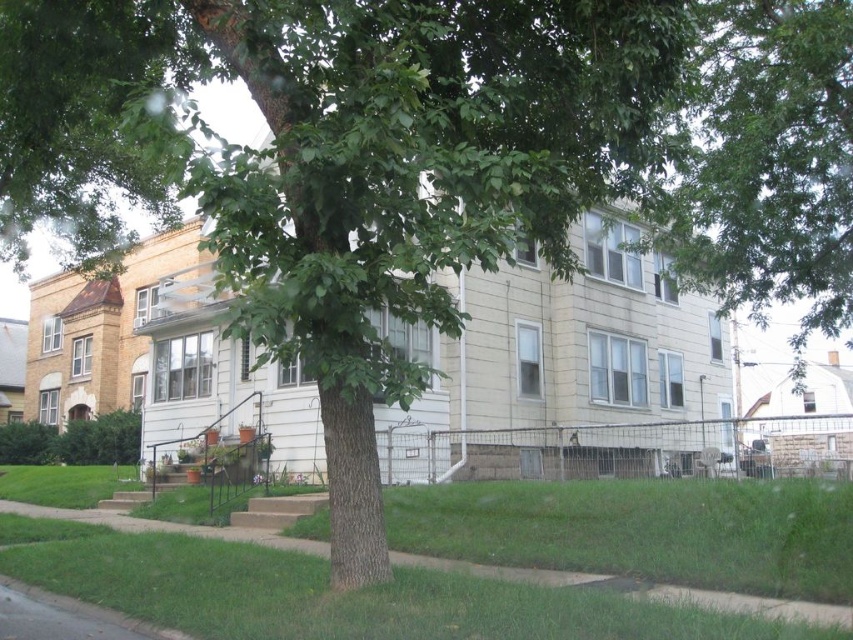
You are standing at the point marked as point (766, 163) in the image. What object is located exactly at that point?

The green leafy tree at upper center is located exactly at point (766, 163).

You are standing on the lawn looking towards the house. You see the green leafy tree at upper center and the green grass at lower center. Which object is closer to your eyes?

The green grass at lower center is closer to your eyes because it is located below the green leafy tree at upper center, which is positioned higher up.

Looking at this image, you are standing in the front yard of the house and want to walk towards the green grass at lower center. Which direction should you move relative to the green leafy tree at upper center?

You should move to the left relative to the green leafy tree at upper center because the green grass at lower center is located to the left of the green leafy tree at upper center.